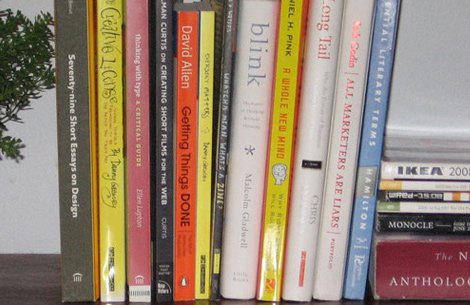
Identify the location of plant. (42, 54).